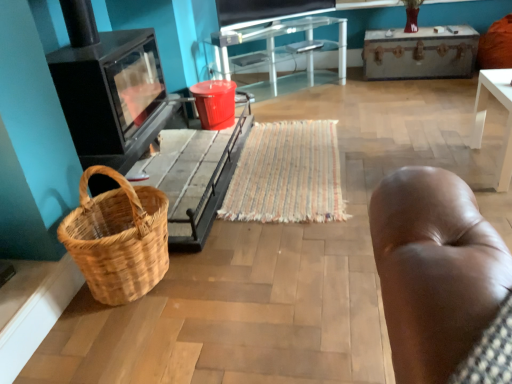
What is the approximate width of black glass stove at left?

black glass stove at left is 25.97 inches wide.

What are the coordinates of `transparent glass table at center` in the screenshot? It's located at (281, 47).

This screenshot has width=512, height=384. I want to click on woven wood basket at lower left, the second table from the top, so click(x=213, y=190).

Describe the element at coordinates (419, 54) in the screenshot. I see `wooden trunk at upper right, acting as the second table starting from the bottom` at that location.

This screenshot has height=384, width=512. Identify the location of black glass stove at left. (109, 90).

Find the location of a particular element. stove on the left of transparent glass table at center is located at coordinates (109, 90).

How many degrees apart are the facing directions of transparent glass table at center and black glass stove at left?

There is a 53-degree angle between the facing directions of transparent glass table at center and black glass stove at left.

Which of these two, transparent glass table at center or black glass stove at left, is bigger?

Bigger between the two is black glass stove at left.

From a real-world perspective, relative to transparent glass table at center, is wooden trunk at upper right, the 2th table positioned from the front, vertically above or below?

In terms of real-world spatial position, wooden trunk at upper right, the 2th table positioned from the front, is below transparent glass table at center.

Which of these two, wooden trunk at upper right, which is counted as the 1th table, starting from the back, or transparent glass table at center, is bigger?

transparent glass table at center is bigger.

Is point (445, 73) positioned before point (250, 26)?

No.

Considering the sizes of objects red plastic bucket at center and wooden trunk at upper right, which is the 1th table from top to bottom, in the image provided, who is shorter, red plastic bucket at center or wooden trunk at upper right, which is the 1th table from top to bottom,?

red plastic bucket at center is shorter.

Is point (221, 104) more distant than point (461, 64)?

No, it is not.

How far apart are red plastic bucket at center and wooden trunk at upper right, the 2th table positioned from the front?

red plastic bucket at center is 1.62 meters from wooden trunk at upper right, the 2th table positioned from the front.

Which point is more forward, (161, 227) or (244, 108)?

The point (161, 227) is closer.

Locate an element on the screen. The image size is (512, 384). the 1st table above when counting from the brown woven picnic basket at lower left (from the image's perspective) is located at coordinates (213, 190).

Is brown woven picnic basket at lower left far from woven wood basket at lower left, which is counted as the 1th table, starting from the left?

brown woven picnic basket at lower left is actually quite close to woven wood basket at lower left, which is counted as the 1th table, starting from the left.

Consider the image. Considering the relative sizes of brown woven picnic basket at lower left and woven wood basket at lower left, which is counted as the 1th table, starting from the left, in the image provided, is brown woven picnic basket at lower left shorter than woven wood basket at lower left, which is counted as the 1th table, starting from the left,?

No.

Does transparent glass table at center appear on the left side of wooden trunk at upper right, acting as the second table starting from the bottom?

Indeed, transparent glass table at center is positioned on the left side of wooden trunk at upper right, acting as the second table starting from the bottom.

From the picture: Which point is more distant from viewer, (342, 73) or (397, 33)?

Point (342, 73)

Is transparent glass table at center thinner than wooden trunk at upper right, the first table in the right-to-left sequence?

In fact, transparent glass table at center might be wider than wooden trunk at upper right, the first table in the right-to-left sequence.

From a real-world perspective, who is located lower, transparent glass table at center or wooden trunk at upper right, the first table in the right-to-left sequence?

wooden trunk at upper right, the first table in the right-to-left sequence, from a real-world perspective.

You are a GUI agent. You are given a task and a screenshot of the screen. Output one action in this format:
    pyautogui.click(x=<x>, y=<y>)
    Task: Click on the furniture on the right of woven wood basket at lower left, the second table viewed from the back
    The width and height of the screenshot is (512, 384).
    Given the screenshot: What is the action you would take?
    pyautogui.click(x=281, y=47)

In terms of height, does transparent glass table at center look taller or shorter compared to woven wood basket at lower left, the second table from the top?

transparent glass table at center is taller than woven wood basket at lower left, the second table from the top.

Considering the relative positions of transparent glass table at center and woven wood basket at lower left, marked as the 1th table in a front-to-back arrangement, in the image provided, is transparent glass table at center to the left of woven wood basket at lower left, marked as the 1th table in a front-to-back arrangement, from the viewer's perspective?

In fact, transparent glass table at center is to the right of woven wood basket at lower left, marked as the 1th table in a front-to-back arrangement.

Is point (267, 49) farther from camera compared to point (199, 205)?

Yes.

You are a GUI agent. You are given a task and a screenshot of the screen. Output one action in this format:
    pyautogui.click(x=<x>, y=<y>)
    Task: Click on the picnic basket in front of the woven wood basket at lower left, placed as the 2th table when sorted from right to left
    This screenshot has height=384, width=512.
    Given the screenshot: What is the action you would take?
    pyautogui.click(x=118, y=238)

Which of these two, woven wood basket at lower left, marked as the 1th table in a front-to-back arrangement, or brown woven picnic basket at lower left, is bigger?

Bigger between the two is woven wood basket at lower left, marked as the 1th table in a front-to-back arrangement.

Can you tell me how much woven wood basket at lower left, marked as the 1th table in a front-to-back arrangement, and brown woven picnic basket at lower left differ in facing direction?

0.00204 degrees separate the facing orientations of woven wood basket at lower left, marked as the 1th table in a front-to-back arrangement, and brown woven picnic basket at lower left.

The height and width of the screenshot is (384, 512). In order to click on stove lying below the transparent glass table at center (from the image's perspective) in this screenshot , I will do point(109,90).

This screenshot has width=512, height=384. What are the coordinates of `furniture lying on the left of wooden trunk at upper right, which is counted as the 1th table, starting from the back` in the screenshot? It's located at (281, 47).

Estimate the real-world distances between objects in this image. Which object is further from black glass stove at left, wooden trunk at upper right, the second table viewed from the left, or matte black television at upper center?

wooden trunk at upper right, the second table viewed from the left, lies further to black glass stove at left than the other object.

From the image, which object appears to be farther from matte black television at upper center, red plastic bucket at center or transparent glass table at center?

The object further to matte black television at upper center is red plastic bucket at center.

Considering their positions, is red plastic bucket at center positioned further to woven wood basket at lower left, which is counted as the 1th table, starting from the left, than matte black television at upper center?

matte black television at upper center lies further to woven wood basket at lower left, which is counted as the 1th table, starting from the left, than the other object.

From the image, which object appears to be nearer to woven wood basket at lower left, marked as the 1th table in a front-to-back arrangement, matte black television at upper center or brown woven picnic basket at lower left?

brown woven picnic basket at lower left.

Which object lies nearer to the anchor point transparent glass table at center, red plastic bucket at center or matte black television at upper center?

Among the two, matte black television at upper center is located nearer to transparent glass table at center.

Which object lies further to the anchor point matte black television at upper center, red plastic bucket at center or black glass stove at left?

black glass stove at left lies further to matte black television at upper center than the other object.

When comparing their distances from woven wood basket at lower left, the second table from the top, does red plastic bucket at center or wooden trunk at upper right, which is the 1th table from top to bottom, seem closer?

red plastic bucket at center is positioned closer to the anchor woven wood basket at lower left, the second table from the top.

When comparing their distances from red plastic bucket at center, does transparent glass table at center or brown woven picnic basket at lower left seem closer?

transparent glass table at center is closer to red plastic bucket at center.

At what (x,y) coordinates should I click in order to perform the action: click on television located between black glass stove at left and wooden trunk at upper right, the 2th table positioned from the front, in the left-right direction. Please return your answer as a coordinate pair (x, y). Image resolution: width=512 pixels, height=384 pixels. Looking at the image, I should click on (266, 11).

Find the location of a particular element. bucket positioned between woven wood basket at lower left, marked as the 1th table in a front-to-back arrangement, and transparent glass table at center from near to far is located at coordinates (215, 103).

The width and height of the screenshot is (512, 384). Identify the location of television positioned between brown woven picnic basket at lower left and wooden trunk at upper right, acting as the second table starting from the bottom, from near to far. (266, 11).

The image size is (512, 384). In order to click on bucket between black glass stove at left and transparent glass table at center along the z-axis in this screenshot , I will do `click(215, 103)`.